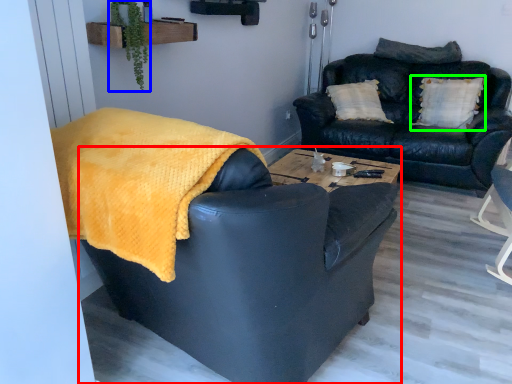
Question: Estimate the real-world distances between objects in this image. Which object is farther from chair (highlighted by a red box), plant (highlighted by a blue box) or pillow (highlighted by a green box)?

Choices:
 (A) plant
 (B) pillow

Answer: (B)